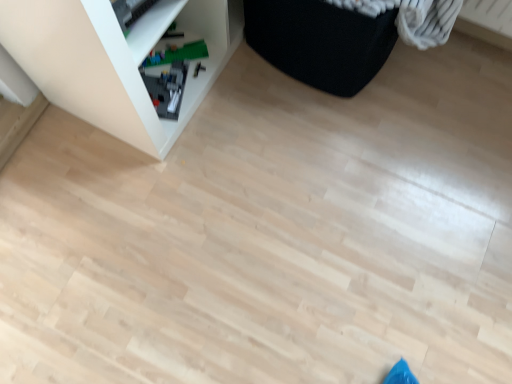
The width and height of the screenshot is (512, 384). Find the location of `vacant space to the right of black fabric ottoman at upper right`. vacant space to the right of black fabric ottoman at upper right is located at coordinates (456, 92).